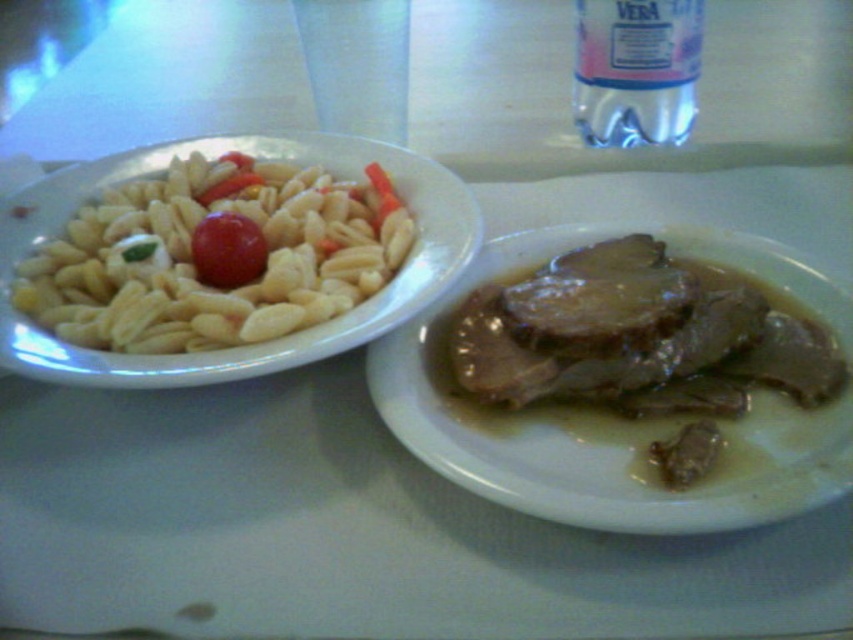
Question: Estimate the real-world distances between objects in this image. Which object is closer to the transparent plastic bottle at upper center?

Choices:
 (A) white matte pasta at left
 (B) glossy red tomato at center left
 (C) brown glossy meat at right

Answer: (C)

Question: Which point appears farthest from the camera in this image?

Choices:
 (A) (376, 221)
 (B) (233, 189)
 (C) (619, 224)

Answer: (B)

Question: Estimate the real-world distances between objects in this image. Which object is farther from the transparent plastic bottle at upper center?

Choices:
 (A) white matte pasta at left
 (B) brown glossy meat at right

Answer: (A)

Question: Is brown glossy meat at right smaller than glossy red tomato at center left?

Choices:
 (A) yes
 (B) no

Answer: (B)

Question: Is brown glossy meat at right positioned at the back of glossy red tomato at center left?

Choices:
 (A) yes
 (B) no

Answer: (B)

Question: Is white matte pasta at left to the right of glossy red tomato at center left from the viewer's perspective?

Choices:
 (A) yes
 (B) no

Answer: (B)